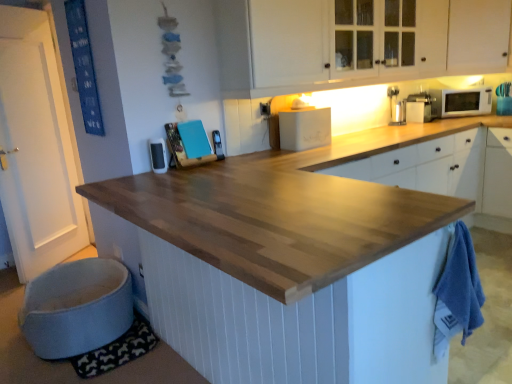
The height and width of the screenshot is (384, 512). Identify the location of vacant area that is in front of white glossy microwave at upper right, marked as the 4th appliance in a left-to-right arrangement. (434, 119).